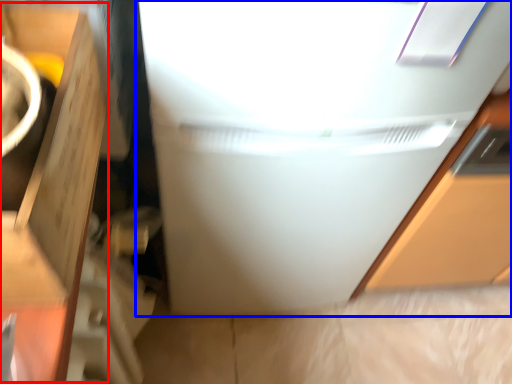
Question: Which point is further to the camera, cardboard box (highlighted by a red box) or refrigerator (highlighted by a blue box)?

Choices:
 (A) cardboard box
 (B) refrigerator

Answer: (B)